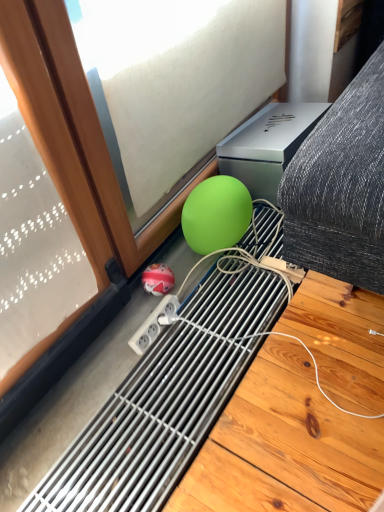
Question: Does green matte sphere at lower center have a lesser height compared to green matte ball at lower center, the 2th ball in the left-to-right sequence?

Choices:
 (A) yes
 (B) no

Answer: (B)

Question: From the image's perspective, is green matte sphere at lower center located beneath green matte ball at lower center, placed as the 1th ball when sorted from right to left?

Choices:
 (A) yes
 (B) no

Answer: (B)

Question: Is green matte sphere at lower center at the left side of green matte ball at lower center, which appears as the 1th ball when viewed from the top?

Choices:
 (A) yes
 (B) no

Answer: (A)

Question: Does green matte sphere at lower center appear on the right side of green matte ball at lower center, which appears as the 1th ball when viewed from the top?

Choices:
 (A) yes
 (B) no

Answer: (B)

Question: Is green matte sphere at lower center facing towards green matte ball at lower center, which is counted as the 2th ball, starting from the bottom?

Choices:
 (A) yes
 (B) no

Answer: (A)

Question: In terms of width, does green matte sphere at lower center look wider or thinner when compared to green matte ball at lower center, which appears as the 1th ball when viewed from the top?

Choices:
 (A) thin
 (B) wide

Answer: (A)

Question: In terms of height, does green matte sphere at lower center look taller or shorter compared to green matte ball at lower center, the 2th ball in the left-to-right sequence?

Choices:
 (A) short
 (B) tall

Answer: (B)

Question: Considering the positions of point (127, 96) and point (196, 220), is point (127, 96) closer or farther from the camera than point (196, 220)?

Choices:
 (A) closer
 (B) farther

Answer: (A)

Question: Considering the relative positions of green matte sphere at lower center and green matte ball at lower center, placed as the 1th ball when sorted from right to left, in the image provided, is green matte sphere at lower center to the left or to the right of green matte ball at lower center, placed as the 1th ball when sorted from right to left,?

Choices:
 (A) left
 (B) right

Answer: (A)

Question: Relative to shiny red ball at lower center, positioned as the 1th ball in left-to-right order, is green matte sphere at lower center in front or behind?

Choices:
 (A) behind
 (B) front

Answer: (B)

Question: From the image's perspective, is green matte sphere at lower center above or below shiny red ball at lower center, which appears as the second ball when viewed from the top?

Choices:
 (A) above
 (B) below

Answer: (A)

Question: From their relative heights in the image, would you say green matte sphere at lower center is taller or shorter than shiny red ball at lower center, positioned as the 1th ball in left-to-right order?

Choices:
 (A) short
 (B) tall

Answer: (B)

Question: Looking at their shapes, would you say green matte sphere at lower center is wider or thinner than shiny red ball at lower center, which appears as the second ball when viewed from the top?

Choices:
 (A) thin
 (B) wide

Answer: (A)

Question: Looking at their shapes, would you say shiny red ball at lower center, which appears as the second ball when viewed from the top, is wider or thinner than green matte sphere at lower center?

Choices:
 (A) thin
 (B) wide

Answer: (B)

Question: From a real-world perspective, is shiny red ball at lower center, positioned as the 1th ball in left-to-right order, positioned above or below green matte sphere at lower center?

Choices:
 (A) below
 (B) above

Answer: (A)